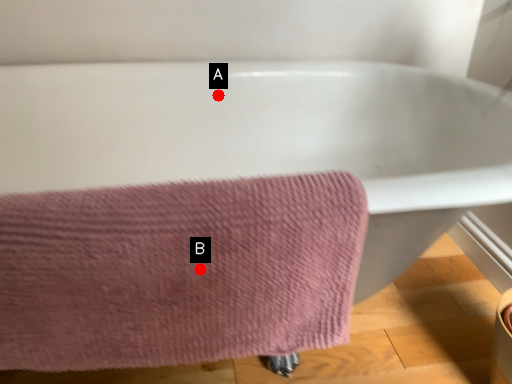
Question: Two points are circled on the image, labeled by A and B beside each circle. Which point is further to the camera?

Choices:
 (A) A is further
 (B) B is further

Answer: (A)